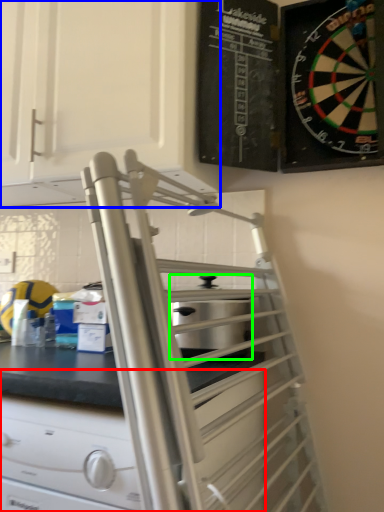
Question: Considering the real-world distances, which object is farthest from drawer (highlighted by a red box)? cabinetry (highlighted by a blue box) or appliance (highlighted by a green box)?

Choices:
 (A) cabinetry
 (B) appliance

Answer: (A)